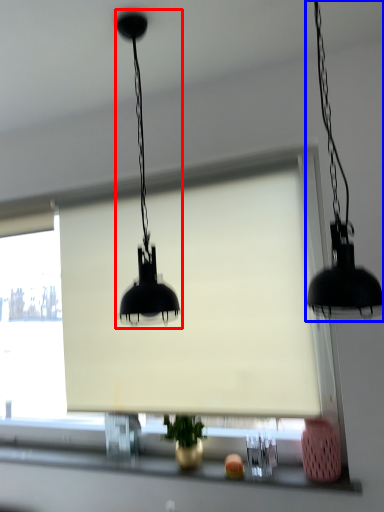
Question: Among these objects, which one is nearest to the camera, lamp (highlighted by a red box) or lamp (highlighted by a blue box)?

Choices:
 (A) lamp
 (B) lamp

Answer: (B)